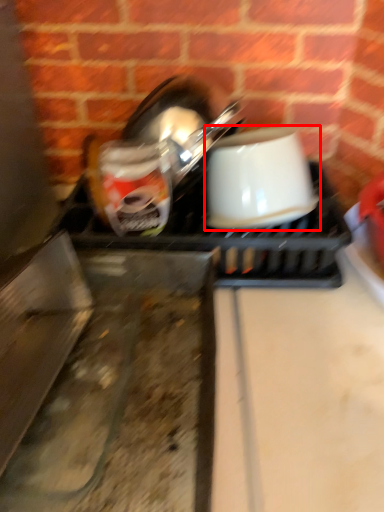
Question: From the image's perspective, what is the correct spatial positioning of coffee cup (annotated by the red box) in reference to appliance?

Choices:
 (A) above
 (B) below

Answer: (A)